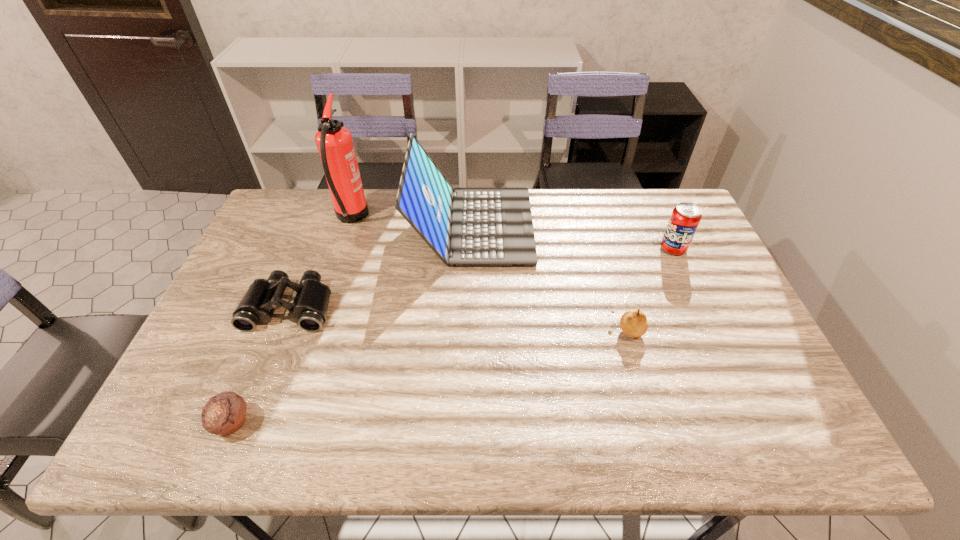
Locate an element on the screen. the tallest object is located at coordinates (334, 142).

This screenshot has height=540, width=960. I want to click on the second tallest object, so click(464, 226).

Locate an element on the screen. This screenshot has width=960, height=540. laptop computer is located at coordinates (464, 226).

I want to click on the third tallest object, so click(685, 218).

Where is `soda can`? The image size is (960, 540). soda can is located at coordinates (685, 218).

Locate an element on the screen. the second object from right to left is located at coordinates (633, 323).

This screenshot has width=960, height=540. I want to click on binoculars, so click(x=309, y=309).

Locate an element on the screen. Image resolution: width=960 pixels, height=540 pixels. the nearest object is located at coordinates (225, 413).

Identify the location of vacant region located 0.380m at the nozzle of the fire extinguisher. The image size is (960, 540). (479, 219).

Image resolution: width=960 pixels, height=540 pixels. Identify the location of free point located on the screen of the third object from right to left. point(632,226).